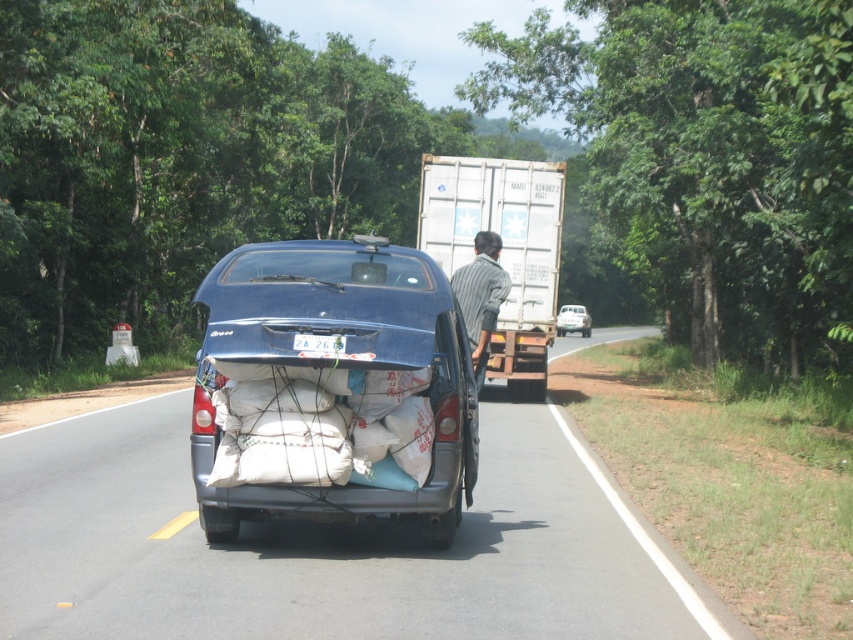
Based on the photo, you are a pedestrian standing at the side of the road. You see the matte blue car at center and the white matte container at center. Which object is closer to the ground?

The matte blue car at center is closer to the ground because it is positioned below the white matte container at center.

You are a driver approaching a narrow bridge that can only accommodate vehicles up to the width of the metallic silver van at center. You are currently driving the white matte container at center. Will your vehicle fit through the bridge?

The white matte container at center is thinner than the metallic silver van at center, so yes, the white matte container at center will fit through the bridge since it is narrower than the maximum allowed width.